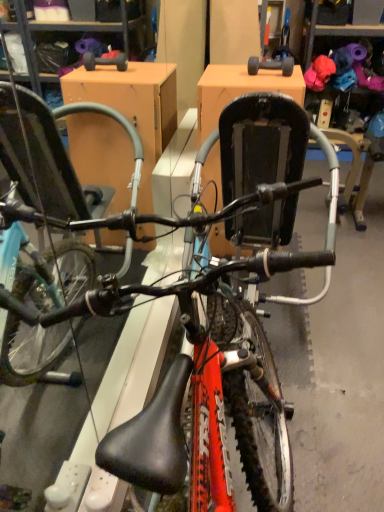
This screenshot has width=384, height=512. Describe the element at coordinates (221, 324) in the screenshot. I see `shiny red bicycle at center` at that location.

Identify the location of shiny red bicycle at center. (221, 324).

Describe the element at coordinates (271, 65) in the screenshot. I see `gray rubber dumbbell at upper center` at that location.

The image size is (384, 512). In order to click on gray rubber dumbbell at upper center in this screenshot , I will do `click(271, 65)`.

At what (x,y) coordinates should I click in order to perform the action: click on shiny red bicycle at center. Please return your answer as a coordinate pair (x, y). Looking at the image, I should click on (221, 324).

Considering the relative positions of shiny red bicycle at center and gray rubber dumbbell at upper center in the image provided, is shiny red bicycle at center to the right of gray rubber dumbbell at upper center from the viewer's perspective?

No, shiny red bicycle at center is not to the right of gray rubber dumbbell at upper center.

Is shiny red bicycle at center behind gray rubber dumbbell at upper center?

That is False.

Considering the points (239, 379) and (279, 61), which point is in front, point (239, 379) or point (279, 61)?

The point (239, 379) is more forward.

From the image's perspective, which one is positioned lower, shiny red bicycle at center or gray rubber dumbbell at upper center?

shiny red bicycle at center is shown below in the image.

From a real-world perspective, is shiny red bicycle at center positioned under gray rubber dumbbell at upper center based on gravity?

Correct, in the physical world, shiny red bicycle at center is lower than gray rubber dumbbell at upper center.

Which object is thinner, shiny red bicycle at center or gray rubber dumbbell at upper center?

gray rubber dumbbell at upper center.

Considering the sizes of shiny red bicycle at center and gray rubber dumbbell at upper center in the image, is shiny red bicycle at center taller or shorter than gray rubber dumbbell at upper center?

Considering their sizes, shiny red bicycle at center has more height than gray rubber dumbbell at upper center.

Looking at the image, does shiny red bicycle at center seem bigger or smaller compared to gray rubber dumbbell at upper center?

shiny red bicycle at center is bigger than gray rubber dumbbell at upper center.

Is shiny red bicycle at center spatially inside gray rubber dumbbell at upper center, or outside of it?

shiny red bicycle at center exists outside the volume of gray rubber dumbbell at upper center.

Is shiny red bicycle at center placed right next to gray rubber dumbbell at upper center?

shiny red bicycle at center and gray rubber dumbbell at upper center are not in contact.

Is shiny red bicycle at center positioned with its back to gray rubber dumbbell at upper center?

No.

Find the location of a particular element. bicycle below the gray rubber dumbbell at upper center (from a real-world perspective) is located at coordinates (221, 324).

Visually, is gray rubber dumbbell at upper center positioned to the left or to the right of shiny red bicycle at center?

In the image, gray rubber dumbbell at upper center appears on the right side of shiny red bicycle at center.

Which object is further away from the camera taking this photo, gray rubber dumbbell at upper center or shiny red bicycle at center?

gray rubber dumbbell at upper center is further from the camera.

Between point (282, 59) and point (266, 346), which one is positioned behind?

The point (282, 59) is more distant.

From the image's perspective, which is below, gray rubber dumbbell at upper center or shiny red bicycle at center?

shiny red bicycle at center, from the image's perspective.

From a real-world perspective, is gray rubber dumbbell at upper center physically located above or below shiny red bicycle at center?

From a real-world perspective, gray rubber dumbbell at upper center is physically above shiny red bicycle at center.

Looking at their sizes, would you say gray rubber dumbbell at upper center is wider or thinner than shiny red bicycle at center?

gray rubber dumbbell at upper center is thinner than shiny red bicycle at center.

In the scene shown: Between gray rubber dumbbell at upper center and shiny red bicycle at center, which one has less height?

gray rubber dumbbell at upper center.

Which of these two, gray rubber dumbbell at upper center or shiny red bicycle at center, is smaller?

gray rubber dumbbell at upper center.

Based on the photo, can shiny red bicycle at center be found inside gray rubber dumbbell at upper center?

No.

Are gray rubber dumbbell at upper center and shiny red bicycle at center making contact?

There is a gap between gray rubber dumbbell at upper center and shiny red bicycle at center.

Is shiny red bicycle at center at the back of gray rubber dumbbell at upper center?

gray rubber dumbbell at upper center is not turned away from shiny red bicycle at center.

What's the angular difference between gray rubber dumbbell at upper center and shiny red bicycle at center's facing directions?

The angle between the facing direction of gray rubber dumbbell at upper center and the facing direction of shiny red bicycle at center is 0.544 degrees.

Where is `bicycle on the left of gray rubber dumbbell at upper center`? bicycle on the left of gray rubber dumbbell at upper center is located at coordinates (221, 324).

Find the location of a particular element. Image resolution: width=384 pixels, height=512 pixels. wheel located on the right of shiny red bicycle at center is located at coordinates (271, 65).

The image size is (384, 512). Find the location of `wheel above the shiny red bicycle at center (from the image's perspective)`. wheel above the shiny red bicycle at center (from the image's perspective) is located at coordinates (271, 65).